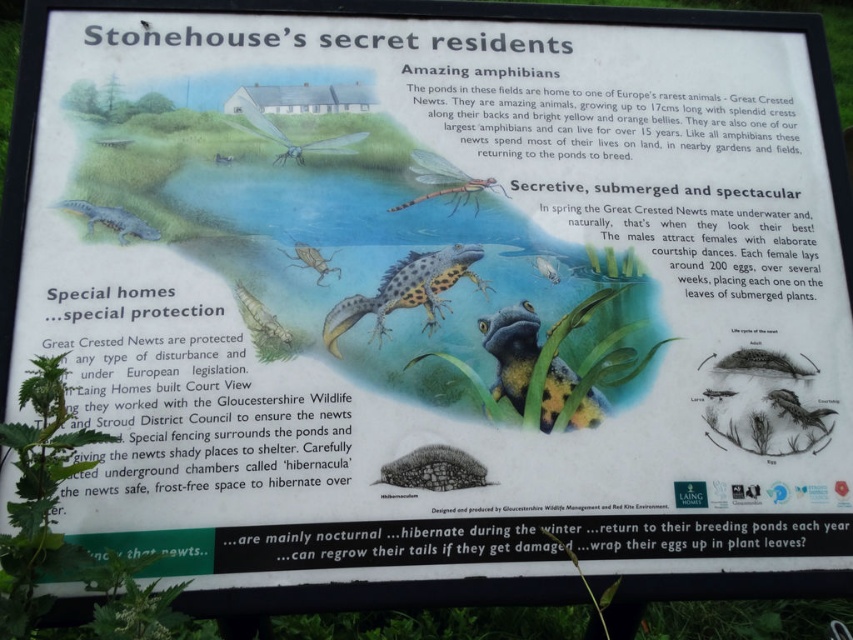
Based on the scene description, where is the shiny blue frog at center positioned relative to the other elements on the signboard?

The shiny blue frog at center is located at point coordinates 0.547 on the x and 0.600 on the y axis.

Based on the scene description, what can you infer about the relative sizes of the shiny blue frog at center and the translucent glass fish at center?

The shiny blue frog at center is much taller than the translucent glass fish at center.